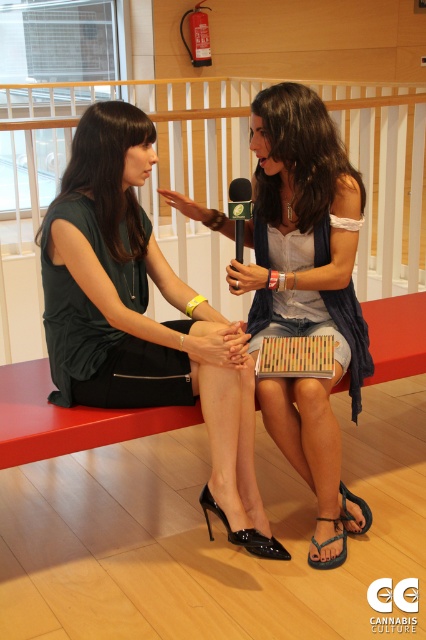
You are a photographer standing 1.5 meters away from the camera position. You need to adjust your position so that the matte black dress at center is in focus. Should you move closer or farther away from the current camera position?

The matte black dress at center is currently 2.00 meters away from the camera. Since you are standing 1.5 meters away from the camera position, you are already closer than the dress. To focus on the dress, you should move farther away to match the 2.00 meters distance between you and the dress.

You are a photographer standing in front of the scene. You want to take a photo of the matte black dress at left and the blue rubber sandal at lower center. Which object will appear larger in the photo?

The matte black dress at left appears larger in the photo because it is closer to the viewer than the blue rubber sandal at lower center.

You are a photographer taking a picture of the scene. You notice the matte black dress at center and the black patent leather sandal at lower center. Which object should you focus on first to ensure it appears sharp in the photo?

The matte black dress at center is further to the viewer than the black patent leather sandal at lower center, so you should focus on the matte black dress at center first to ensure it appears sharp.